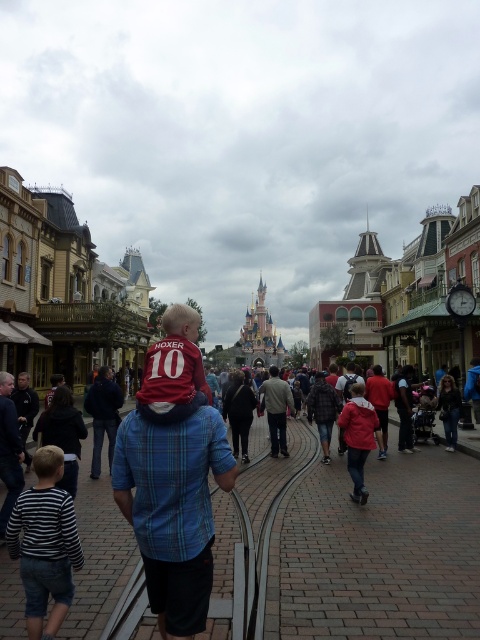
Looking at this image, you are standing at the entrance of the theme park and want to locate the matte red shirt at center. According to the coordinate system where the bottom left corner is the origin, which direction should you look to find it?

The matte red shirt at center is located at point 0.855 in the x coordinate and 0.721 in the y coordinate. Since the x coordinate is closer to 1, it means the object is to the right side. The y coordinate is closer to 0.7, which is towards the top. So you should look towards the upper right direction.

You are a photographer at the theme park and need to capture both the matte red shirt at center and the striped cotton shirt at lower left in a single shot. Which shirt should you focus on to ensure both are in frame without zooming in or out?

The matte red shirt at center is larger than the striped cotton shirt at lower left, so focusing on the matte red shirt at center will ensure both are in frame without needing to adjust the zoom.